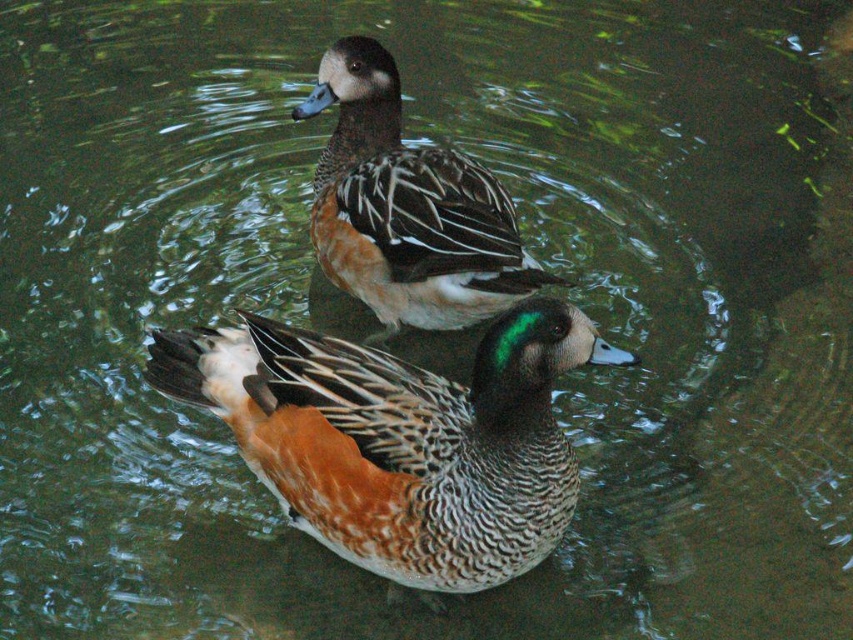
Based on the photo, you are a wildlife photographer aiming to capture both the speckled brown duck at center and the brown speckled duck at upper center in a single frame. Given their sizes, which duck would appear larger in your photo?

The speckled brown duck at center would appear larger in the photo because its width is larger than the brown speckled duck at upper center.

You are observing two points in the image of the ducks. The first point is at coordinates point (410, 502) and the second is at point (318, 109). Which of these points is nearer to you as you look at the image?

Point (410, 502) is closer to the camera than point (318, 109), so the first point is nearer to you.